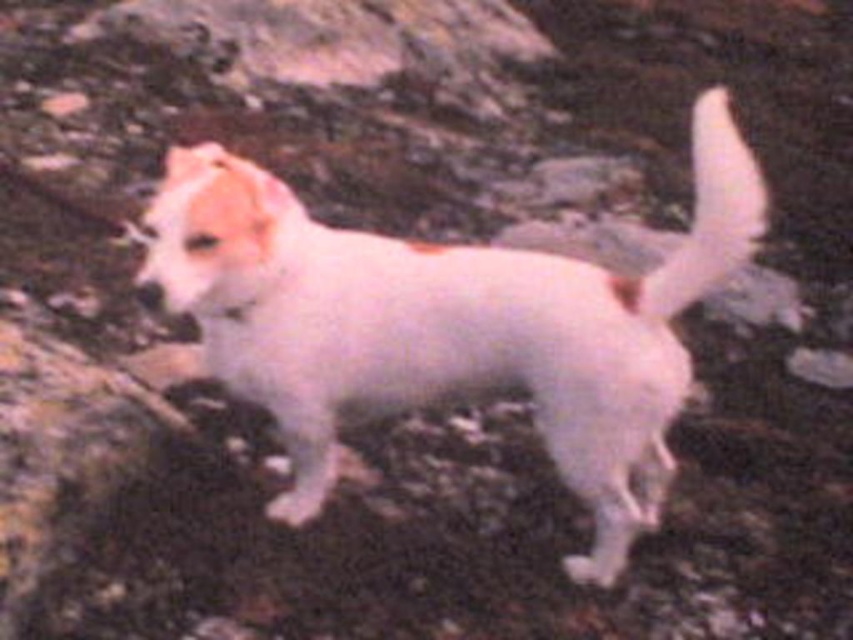
Question: Which object is closer to the camera taking this photo?

Choices:
 (A) white fluffy dog at center
 (B) white fluffy tail at upper right

Answer: (A)

Question: Is the position of white fluffy dog at center less distant than that of white fluffy tail at upper right?

Choices:
 (A) no
 (B) yes

Answer: (B)

Question: From the image, what is the correct spatial relationship of white fluffy dog at center in relation to white fluffy tail at upper right?

Choices:
 (A) left
 (B) right

Answer: (A)

Question: Does white fluffy dog at center have a lesser width compared to white fluffy tail at upper right?

Choices:
 (A) no
 (B) yes

Answer: (A)